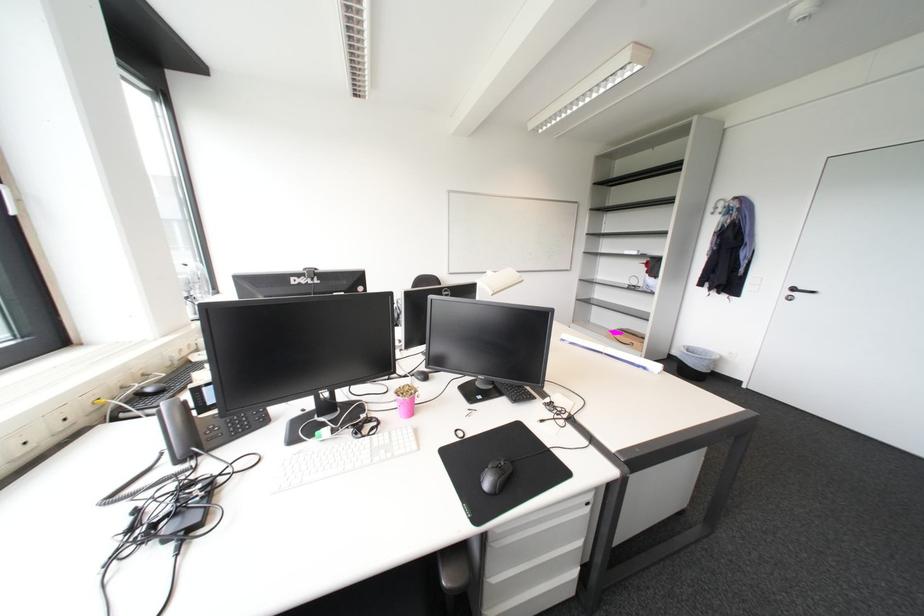
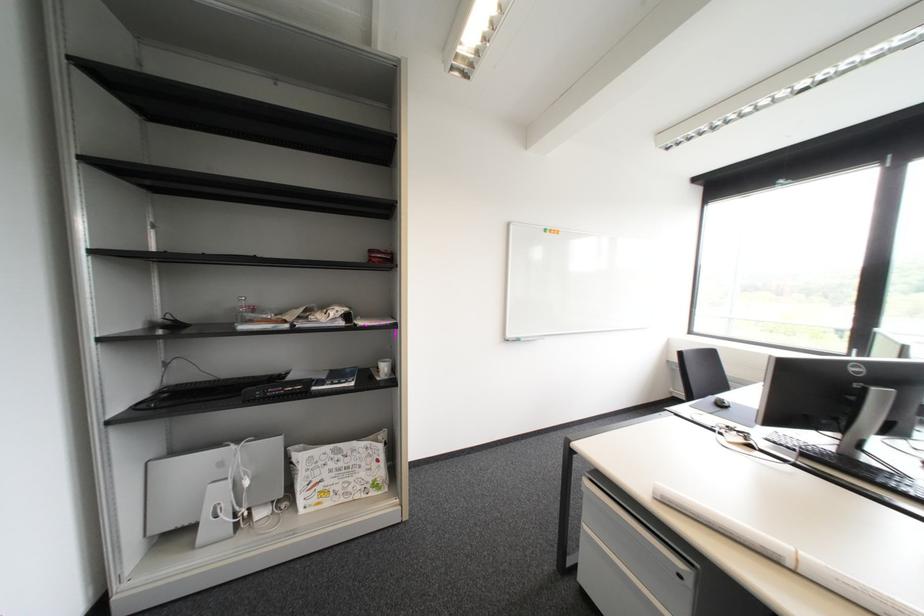
Question: I am providing you with two images of the same scene from different viewpoints. Which of the following objects are not visible in image2?

Choices:
 (A) cabinet drawer handle
 (B) pink pencil holder
 (C) black computer mouse
 (D) green marker pen

Answer: (B)